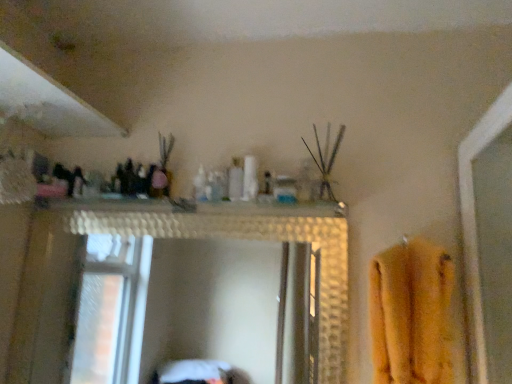
Question: Is translucent plastic bottle at center shorter than yellow fuzzy bath towel at right?

Choices:
 (A) no
 (B) yes

Answer: (B)

Question: From the image's perspective, is translucent plastic bottle at center on yellow fuzzy bath towel at right?

Choices:
 (A) no
 (B) yes

Answer: (B)

Question: Is yellow fuzzy bath towel at right located within translucent plastic bottle at center?

Choices:
 (A) yes
 (B) no

Answer: (B)

Question: Is translucent plastic bottle at center to the right of yellow fuzzy bath towel at right from the viewer's perspective?

Choices:
 (A) yes
 (B) no

Answer: (B)

Question: From a real-world perspective, is translucent plastic bottle at center located higher than yellow fuzzy bath towel at right?

Choices:
 (A) no
 (B) yes

Answer: (B)

Question: Is translucent plastic bottle at center not within yellow fuzzy bath towel at right?

Choices:
 (A) no
 (B) yes

Answer: (B)

Question: Does yellow fuzzy bath towel at right appear on the left side of translucent plastic bottle at center?

Choices:
 (A) no
 (B) yes

Answer: (A)

Question: From the image's perspective, is yellow fuzzy bath towel at right on translucent plastic bottle at center?

Choices:
 (A) yes
 (B) no

Answer: (B)

Question: Does yellow fuzzy bath towel at right have a lesser height compared to translucent plastic bottle at center?

Choices:
 (A) yes
 (B) no

Answer: (B)

Question: Does yellow fuzzy bath towel at right have a larger size compared to translucent plastic bottle at center?

Choices:
 (A) no
 (B) yes

Answer: (B)

Question: Can we say yellow fuzzy bath towel at right lies outside translucent plastic bottle at center?

Choices:
 (A) no
 (B) yes

Answer: (B)

Question: Is yellow fuzzy bath towel at right smaller than translucent plastic bottle at center?

Choices:
 (A) yes
 (B) no

Answer: (B)

Question: Is white glossy shelf at upper center outside yellow fuzzy bath towel at right?

Choices:
 (A) yes
 (B) no

Answer: (A)